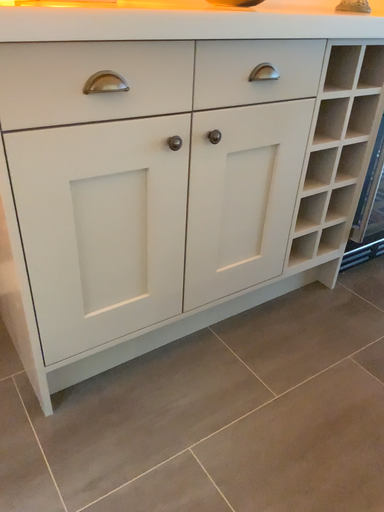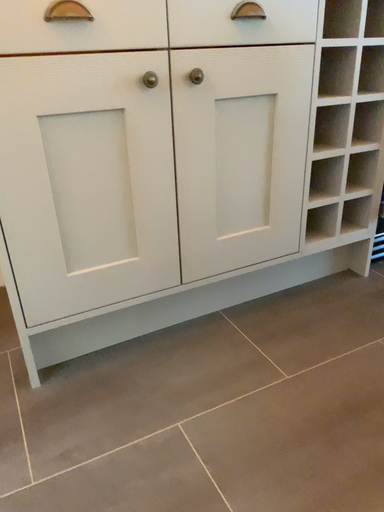
Question: Which way did the camera rotate in the video?

Choices:
 (A) rotated right
 (B) rotated left

Answer: (B)